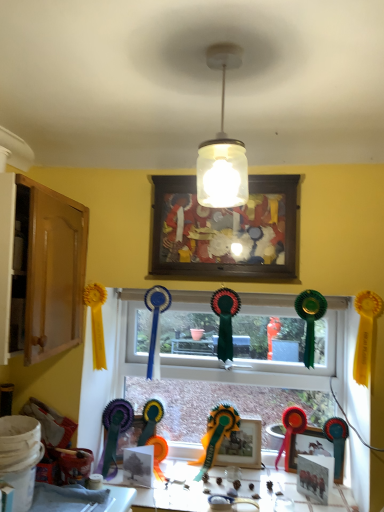
Find the location of a particular element. The image size is (384, 512). vacant space to the left of matte white picture frame at lower center, which is the third picture frame from back to front is located at coordinates (276, 497).